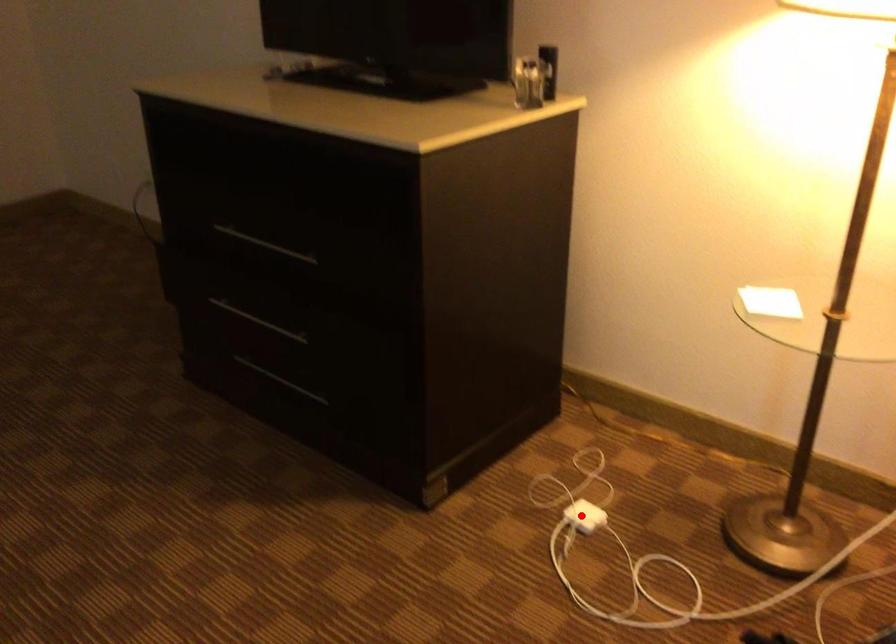
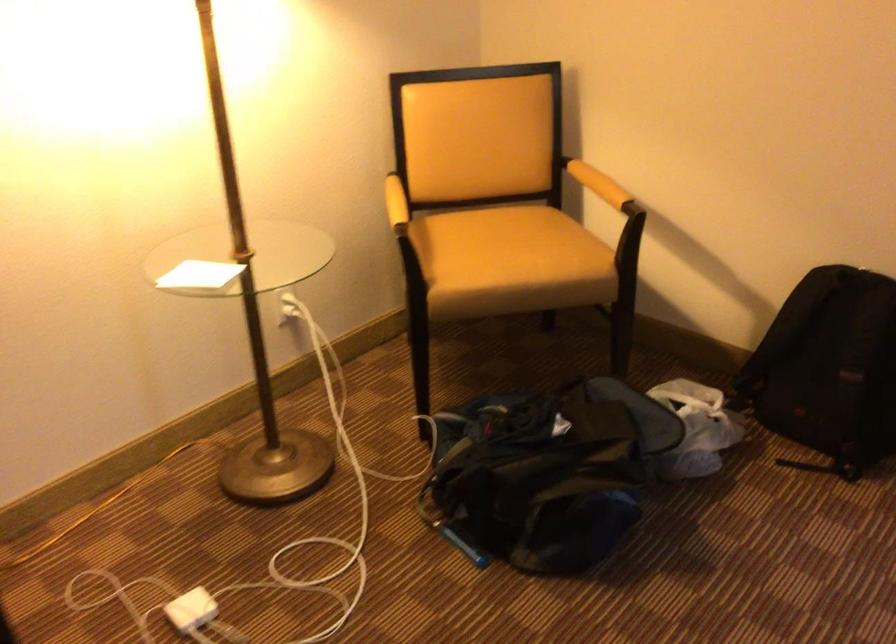
Question: I am providing you with two images of the same scene from different viewpoints. Given a red point in image1, look at the same physical point in image2. Is it:

Choices:
 (A) Closer to the viewpoint
 (B) Farther from the viewpoint

Answer: (A)